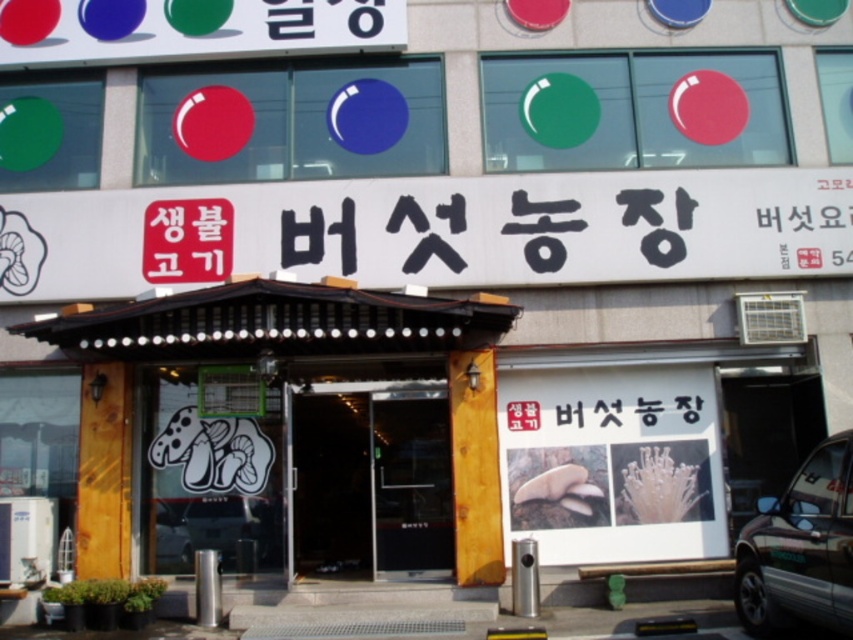
Question: Among these objects, which one is nearest to the camera?

Choices:
 (A) wooden door at center
 (B) metallic silver car at center
 (C) red paper sign at center

Answer: (A)

Question: Which object is farther from the camera taking this photo?

Choices:
 (A) metallic silver car at center
 (B) transparent glass door at center

Answer: (A)

Question: In this image, where is wooden door at center located relative to metallic silver car at center?

Choices:
 (A) left
 (B) right

Answer: (B)

Question: Does wooden door at center appear over metallic silver suv at right?

Choices:
 (A) yes
 (B) no

Answer: (A)

Question: Which point appears farthest from the camera in this image?

Choices:
 (A) (300, 513)
 (B) (247, 508)
 (C) (436, 557)
 (D) (155, 225)

Answer: (A)

Question: Is transparent glass door at center above metallic silver car at center?

Choices:
 (A) no
 (B) yes

Answer: (B)